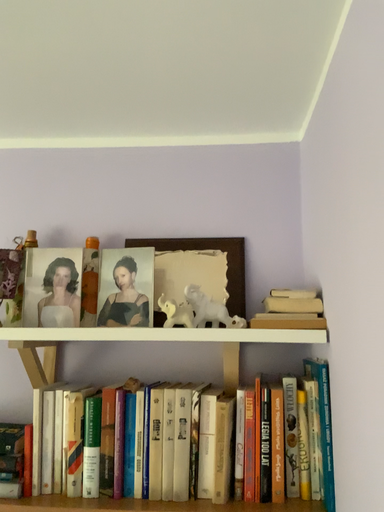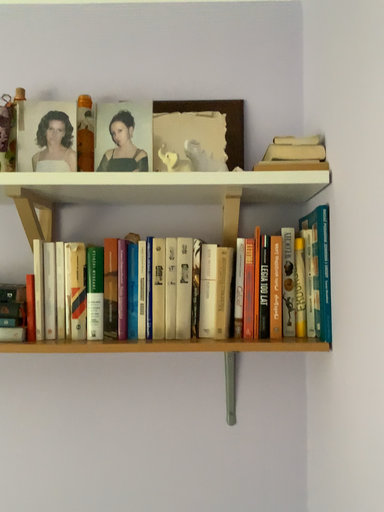
Question: Which way did the camera rotate in the video?

Choices:
 (A) rotated upward
 (B) rotated downward

Answer: (B)